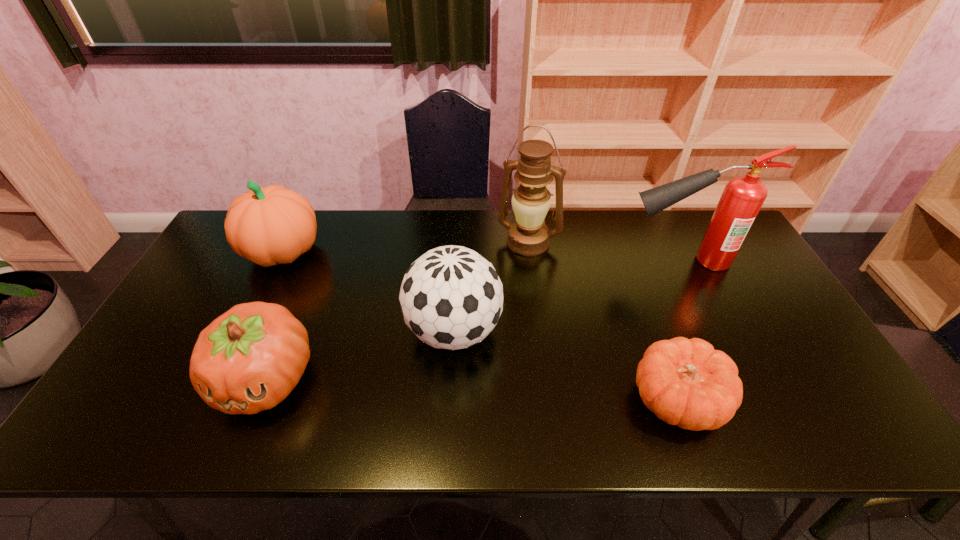
Locate an element on the screen. vacant point located between the rightmost pumpkin and the oil lamp is located at coordinates (603, 322).

Where is `vacant space that's between the second shortest object and the shortest pumpkin`? This screenshot has height=540, width=960. vacant space that's between the second shortest object and the shortest pumpkin is located at coordinates (471, 390).

This screenshot has height=540, width=960. I want to click on vacant area that lies between the second shortest object and the soccer ball, so click(x=360, y=355).

I want to click on vacant area that lies between the shortest object and the fifth tallest object, so click(471, 390).

The height and width of the screenshot is (540, 960). Find the location of `free spot between the shortest object and the fourth object from left to right`. free spot between the shortest object and the fourth object from left to right is located at coordinates (603, 322).

Choose which object is the fifth nearest neighbor to the soccer ball. Please provide its 2D coordinates. Your answer should be formatted as a tuple, i.e. [(x, y)], where the tuple contains the x and y coordinates of a point satisfying the conditions above.

[(743, 196)]

Where is `the closest object to the rightmost pumpkin`? This screenshot has width=960, height=540. the closest object to the rightmost pumpkin is located at coordinates (451, 297).

At what (x,y) coordinates should I click in order to perform the action: click on pumpkin that stands as the second closest to the tallest pumpkin. Please return your answer as a coordinate pair (x, y). This screenshot has width=960, height=540. Looking at the image, I should click on (685, 382).

The height and width of the screenshot is (540, 960). I want to click on the closest pumpkin to the fifth tallest object, so click(x=272, y=225).

Image resolution: width=960 pixels, height=540 pixels. What are the coordinates of `free space that satisfies the following two spatial constraints: 1. at the nozzle of the fire extinguisher; 2. on the side of the second tallest pumpkin with the cute face` in the screenshot? It's located at (739, 379).